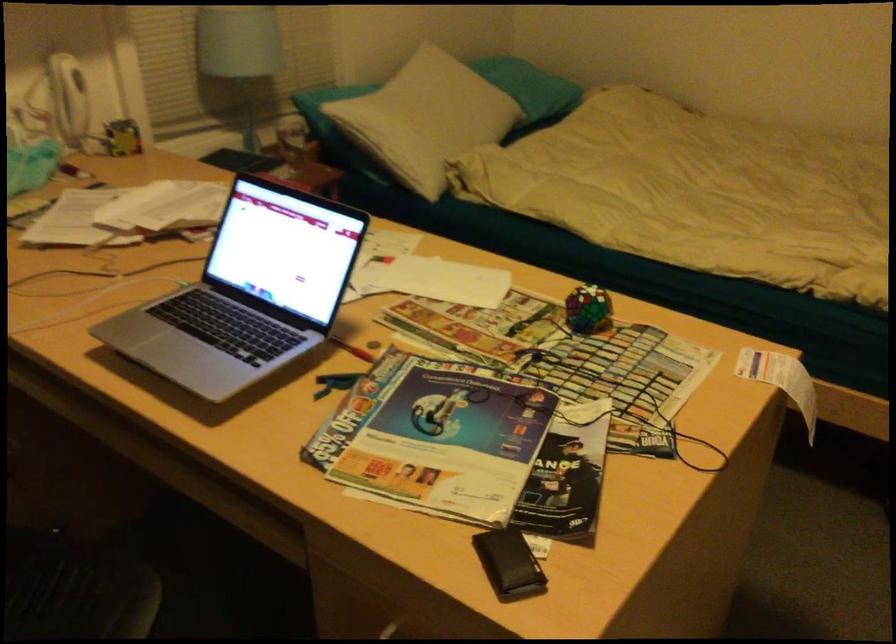
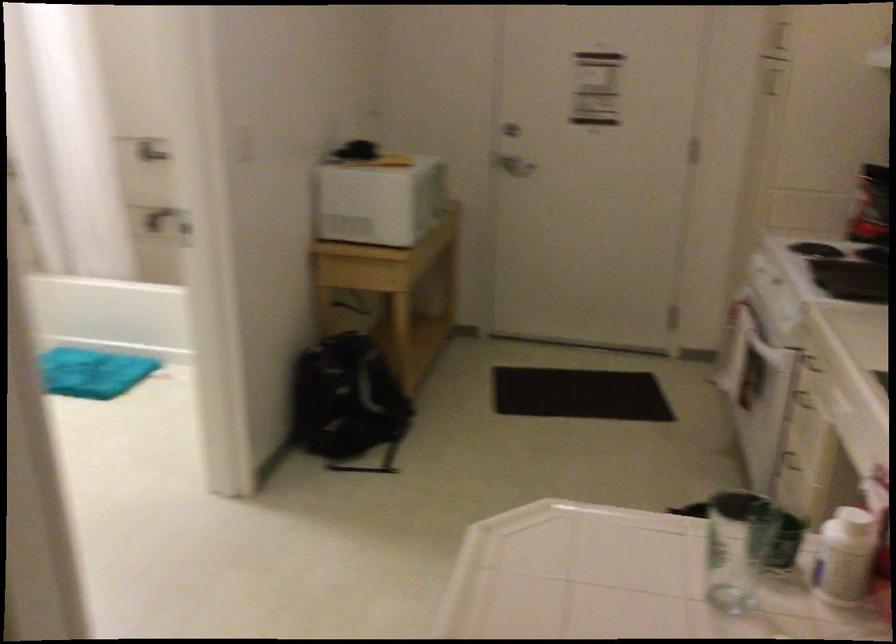
How did the camera likely rotate?

The camera's rotation is toward right-down.